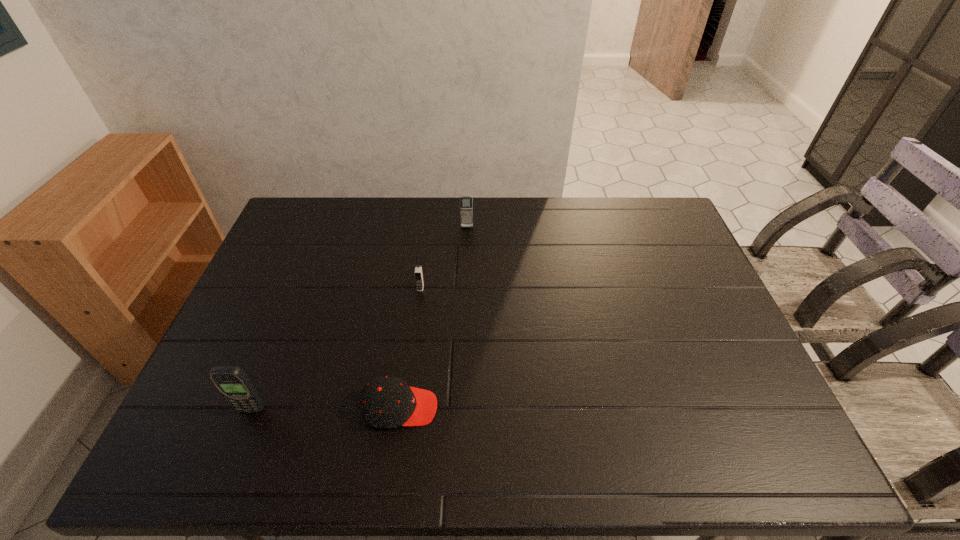
Identify the location of the leftmost object. Image resolution: width=960 pixels, height=540 pixels. (232, 382).

Find the location of `the leftmost cellular telephone`. the leftmost cellular telephone is located at coordinates (232, 382).

Where is `the farthest object`? This screenshot has width=960, height=540. the farthest object is located at coordinates (466, 203).

At what (x,y) coordinates should I click in order to perform the action: click on the farthest cellular telephone. Please return your answer as a coordinate pair (x, y). The height and width of the screenshot is (540, 960). Looking at the image, I should click on (466, 203).

The width and height of the screenshot is (960, 540). Find the location of `the second cellular telephone from right to left`. the second cellular telephone from right to left is located at coordinates (418, 272).

Identify the location of the third nearest object. (418, 272).

Locate an element on the screen. cap is located at coordinates (387, 402).

Identify the location of vacant space positioned on the screen of the tallest object. (239, 441).

Where is `free spot located on the front-facing side of the farthest cellular telephone`? free spot located on the front-facing side of the farthest cellular telephone is located at coordinates tap(467, 246).

Locate an element on the screen. This screenshot has width=960, height=540. vacant space located on the front-facing side of the second farthest cellular telephone is located at coordinates (408, 385).